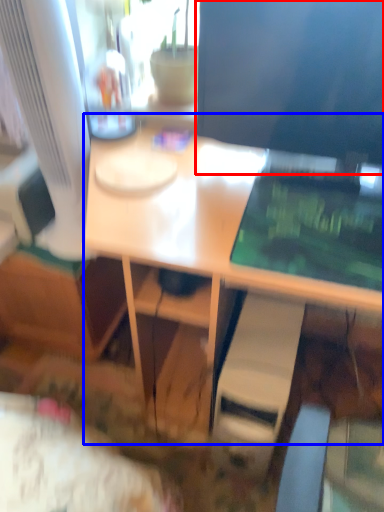
Question: Which point is further to the camera, computer monitor (highlighted by a red box) or desk (highlighted by a blue box)?

Choices:
 (A) computer monitor
 (B) desk

Answer: (A)